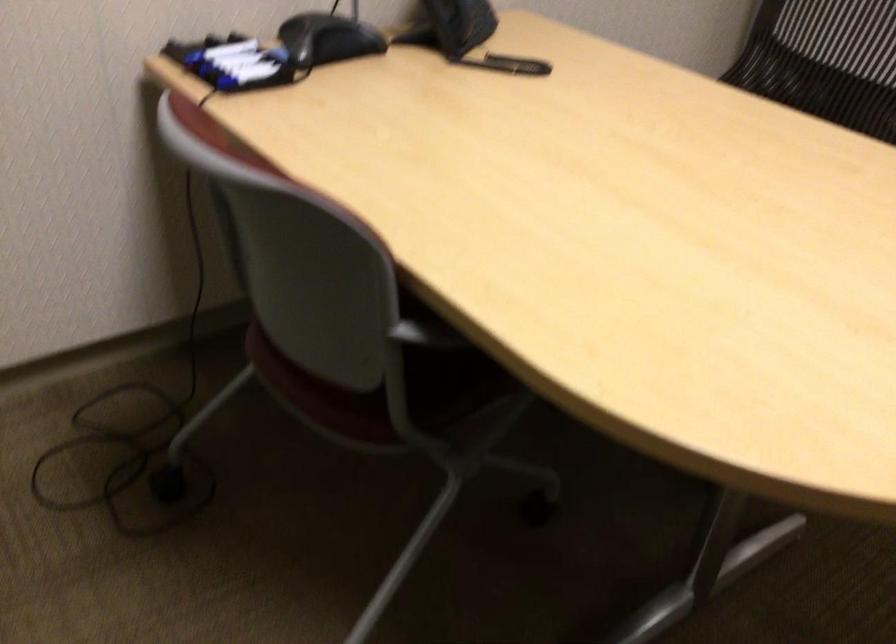
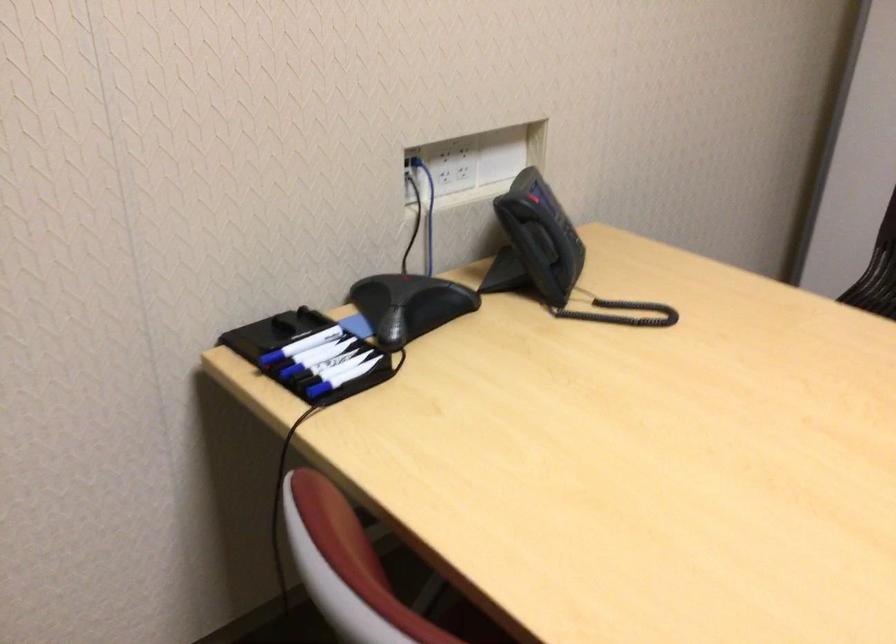
Which direction would the cameraman need to move to produce the second image?

The cameraman moved toward left, forward.